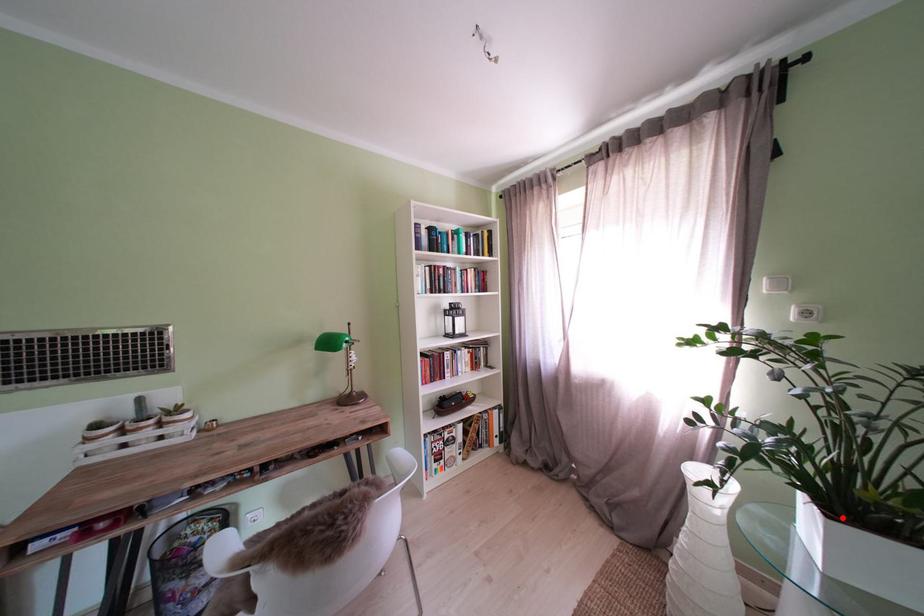
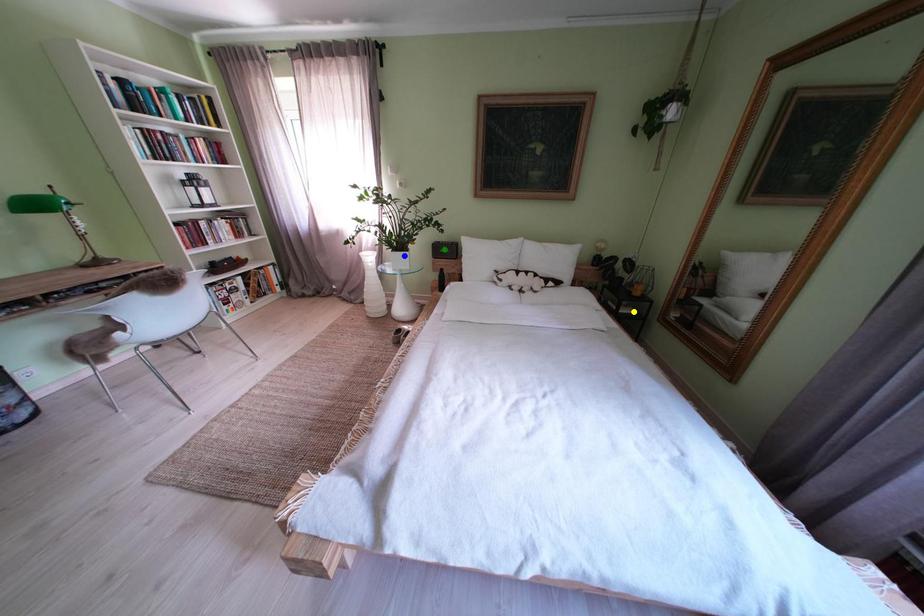
Question: I am providing you with two images of the same scene from different viewpoints. A red point is marked on the first image. You are given multiple points on the second image. Which point in image 2 is actually the same real-world point as the red point in image 1?

Choices:
 (A) blue point
 (B) yellow point
 (C) green point

Answer: (A)